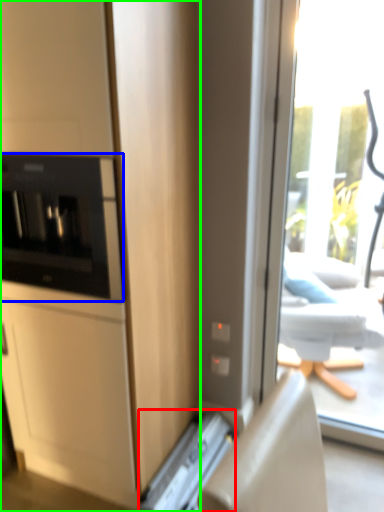
Question: Which object is the closest to the appliance (highlighted by a red box)? Choose among these: home appliance (highlighted by a blue box) or cabinetry (highlighted by a green box).

Choices:
 (A) home appliance
 (B) cabinetry

Answer: (B)